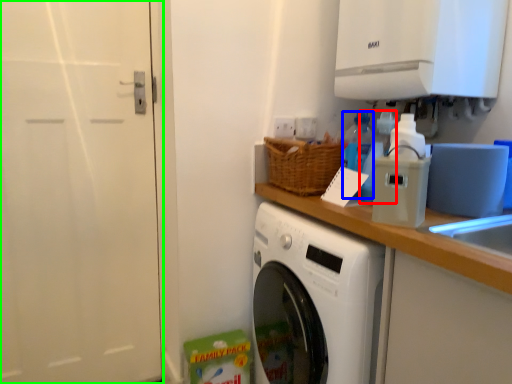
Question: Which object is the closest to the bottle (highlighted by a red box)? Choose among these: bottle (highlighted by a blue box) or screen door (highlighted by a green box).

Choices:
 (A) bottle
 (B) screen door

Answer: (A)